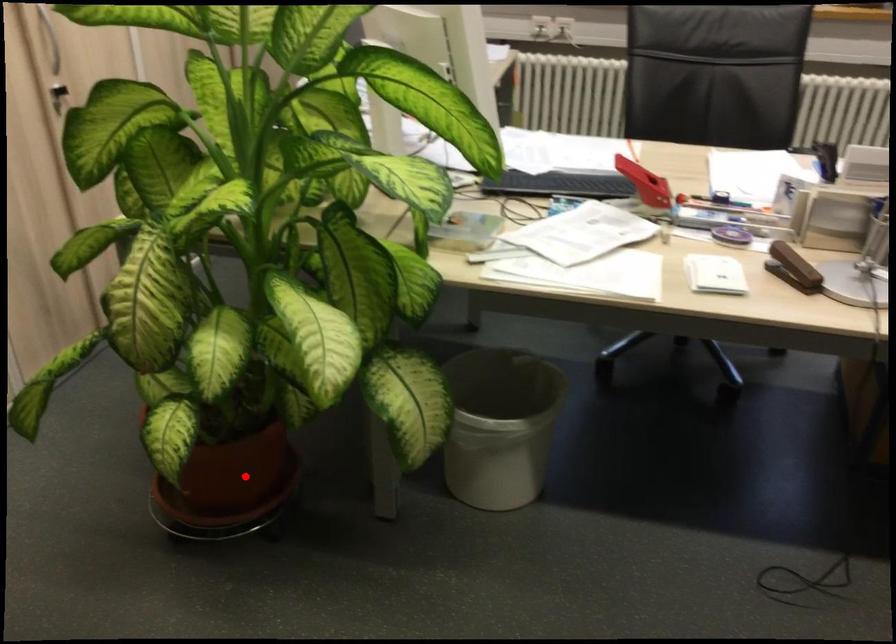
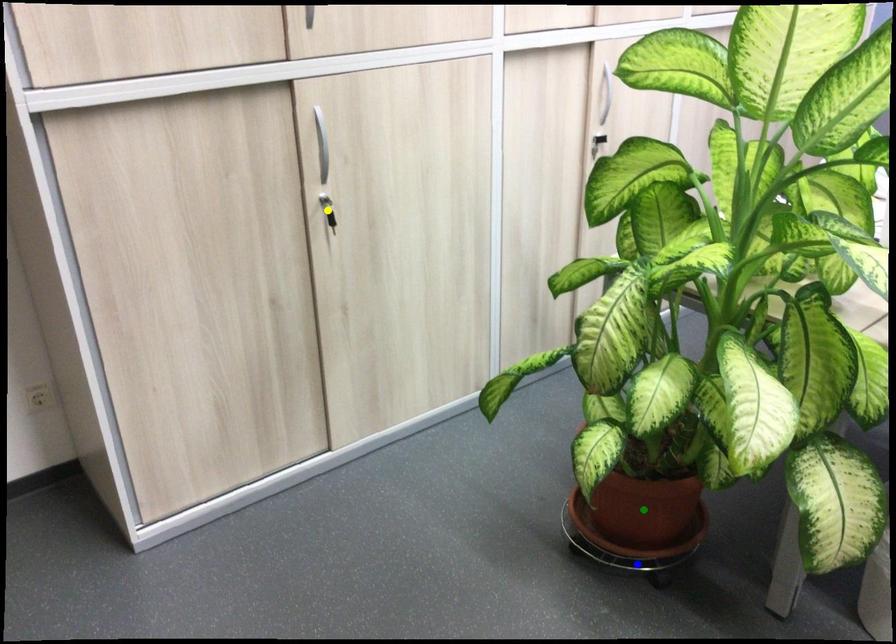
Question: I am providing you with two images of the same scene from different viewpoints. A red point is marked on the first image. You are given multiple points on the second image. Which point in image 2 is actually the same real-world point as the red point in image 1?

Choices:
 (A) blue point
 (B) yellow point
 (C) green point

Answer: (C)